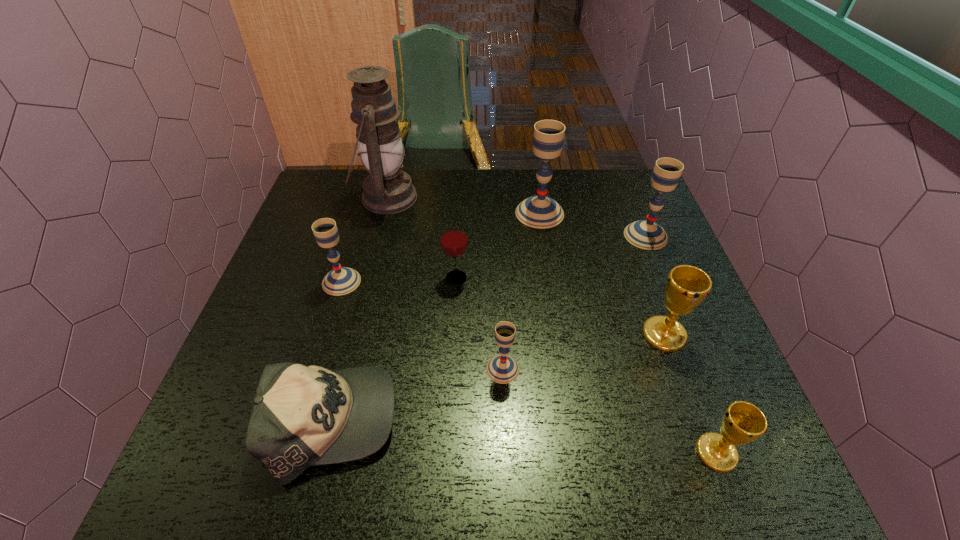
Image resolution: width=960 pixels, height=540 pixels. Identify the location of vacant space at the right edge of the desktop. [663, 380].

This screenshot has width=960, height=540. In the image, there is a desktop. Find the location of `blank space at the far left corner`. blank space at the far left corner is located at coordinates (348, 213).

Locate an element on the screen. blank area at the far right corner is located at coordinates (613, 183).

Where is `free space between the tallest object and the glass`? free space between the tallest object and the glass is located at coordinates (421, 238).

Identify the location of free point between the eighth shortest object and the nearest gray chalice. (521, 291).

The height and width of the screenshot is (540, 960). What are the coordinates of `empty space that is in between the red glass and the third nearest chalice` in the screenshot? It's located at (561, 306).

Where is `vacant area that lies between the fifth farthest chalice and the tallest object`? vacant area that lies between the fifth farthest chalice and the tallest object is located at coordinates (444, 284).

The height and width of the screenshot is (540, 960). Identify the location of empty space that is in between the bigger gold chalice and the oil lamp. point(525,266).

Locate an element on the screen. free spot between the fourth object from left to right and the smaller gold chalice is located at coordinates (587, 366).

Where is `vacant space in between the leftmost gray chalice and the nearer gold chalice`? Image resolution: width=960 pixels, height=540 pixels. vacant space in between the leftmost gray chalice and the nearer gold chalice is located at coordinates (529, 367).